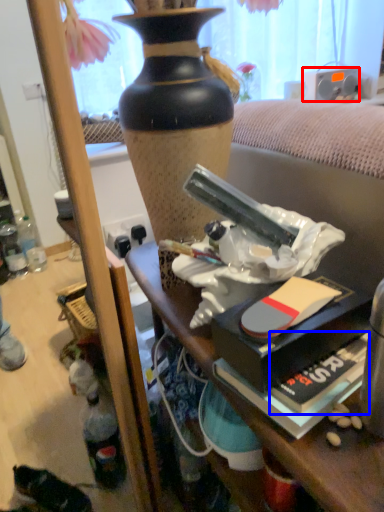
Question: Which object is further to the camera taking this photo, loudspeaker (highlighted by a red box) or paperback book (highlighted by a blue box)?

Choices:
 (A) loudspeaker
 (B) paperback book

Answer: (A)